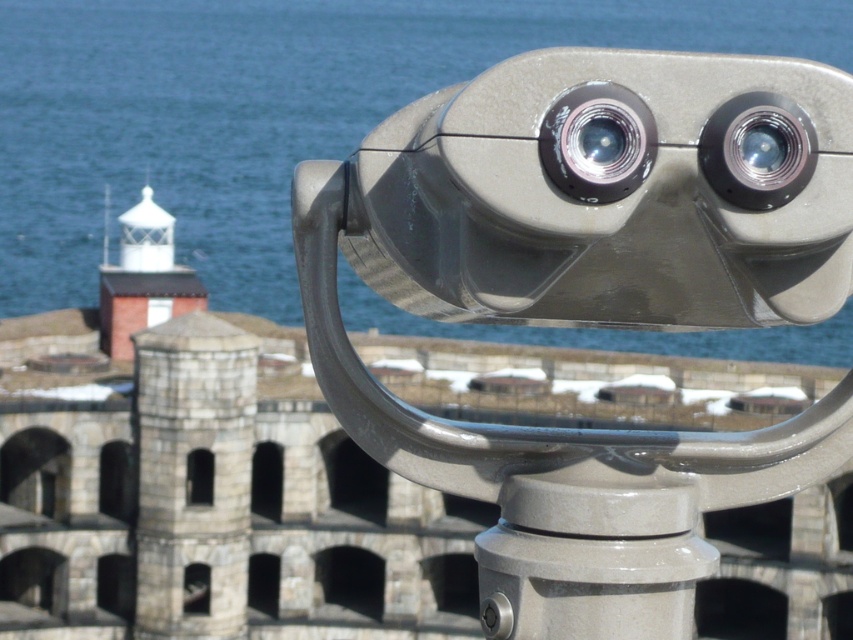
You are a maintenance worker who needs to inspect both the blue water at upper center and the matte silver lens at upper right. Given that your ladder can extend up to 50 meters, can you safely reach both objects without needing additional equipment?

The distance between the blue water at upper center and the matte silver lens at upper right is 54.15 meters. Since your ladder only extends to 50 meters, you cannot safely reach both objects without additional equipment.

Looking at this image, you are standing at a scenic overlook and see the blue water at upper center and the matte silver lens at upper right. Which object is positioned higher in the scene?

The blue water at upper center is located above the matte silver lens at upper right, so it is positioned higher in the scene.